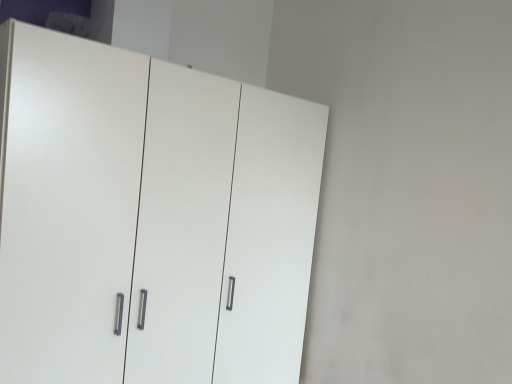
Locate an element on the screen. Image resolution: width=512 pixels, height=384 pixels. white matte cabinet at upper left is located at coordinates (150, 218).

What do you see at coordinates (150, 218) in the screenshot? The height and width of the screenshot is (384, 512). I see `white matte cabinet at upper left` at bounding box center [150, 218].

Image resolution: width=512 pixels, height=384 pixels. I want to click on white matte cabinet at upper left, so click(x=150, y=218).